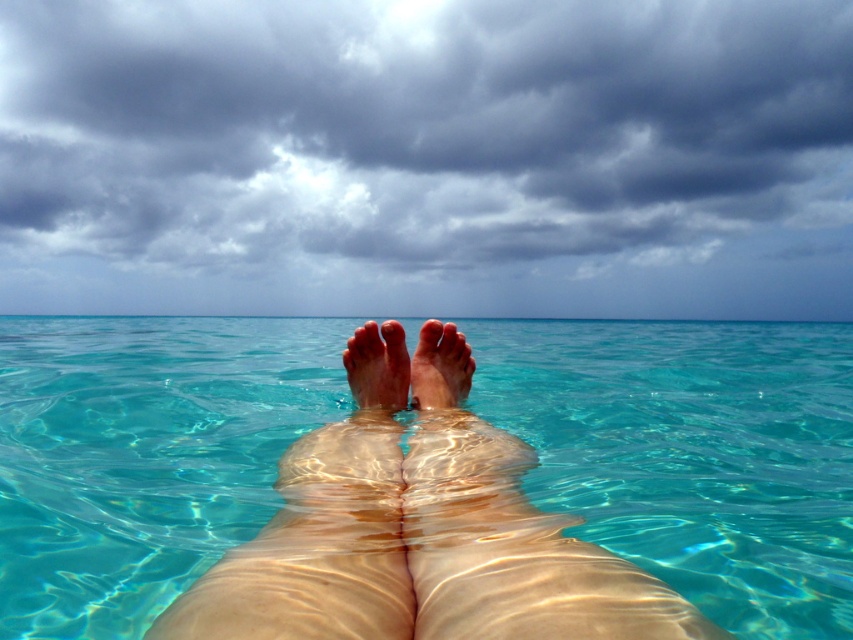
What do you see at coordinates (691, 452) in the screenshot? I see `clear water at center` at bounding box center [691, 452].

Is point (224, 522) farther from viewer compared to point (221, 604)?

Yes.

Is point (701, 515) positioned before point (326, 624)?

No, (701, 515) is further to viewer.

This screenshot has height=640, width=853. I want to click on clear water at center, so click(691, 452).

Does clear water at center come behind pale skin at center?

That is True.

From the picture: Does clear water at center appear on the left side of pale skin at center?

Correct, you'll find clear water at center to the left of pale skin at center.

Does point (283, 387) come farther from viewer compared to point (419, 470)?

That is True.

The width and height of the screenshot is (853, 640). Identify the location of clear water at center. (691, 452).

Who is higher up, clear water at center or smooth skin foot at center?

Positioned higher is clear water at center.

Between point (154, 358) and point (445, 353), which one is positioned behind?

The point (154, 358) is more distant.

The image size is (853, 640). What are the coordinates of `clear water at center` in the screenshot? It's located at (691, 452).

This screenshot has height=640, width=853. In order to click on clear water at center in this screenshot , I will do `click(691, 452)`.